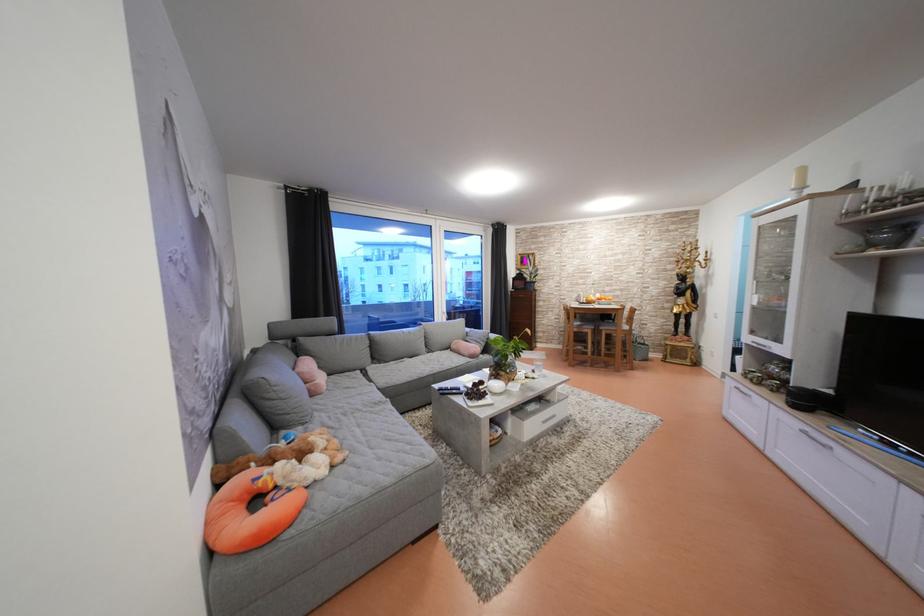
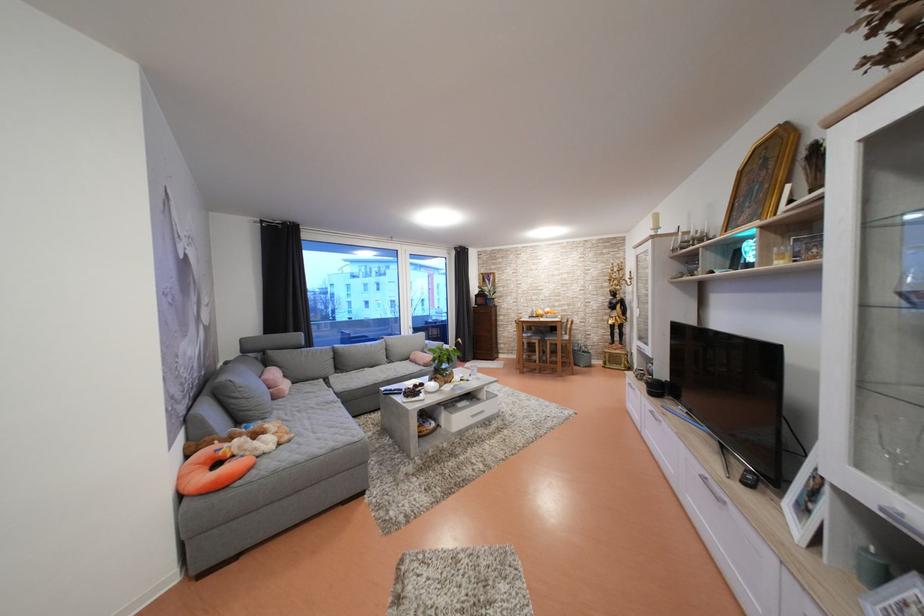
Locate, in the second image, the point that corresponds to (541,373) in the first image.

(476, 377)